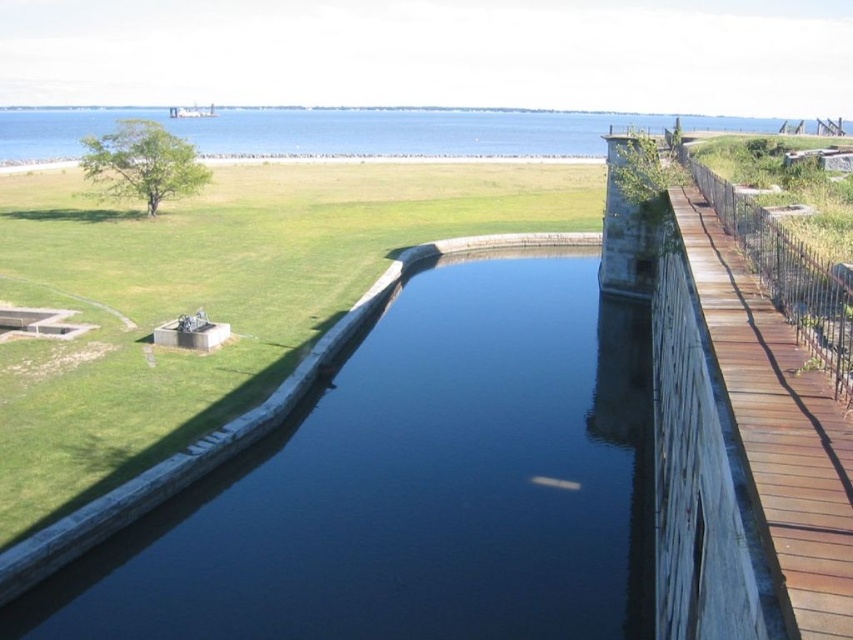
You are standing at the origin point of the coordinate system. Based on the scene, where is the dark stone canal at center located?

The dark stone canal at center is located at point (413, 486) in the coordinate system.

You are standing at the origin point of the coordinate system. You want to reach the blue water at center. Which direction should you move in?

Since the blue water at center is located at coordinate point (328, 132), you should move northeast to reach it.

In the scene shown: You are standing on the wooden walkway and want to cross to the stone wall. You see the dark stone canal at center and the brown wooden rail at right. Which object should you avoid stepping into to reach the stone wall safely?

You should avoid stepping into the dark stone canal at center, as it is located to the left of the brown wooden rail at right and represents the water body, while the brown wooden rail at right is part of the walkway enclosure. Stepping into the canal could be dangerous, so stay on the wooden rail side toward the stone wall.